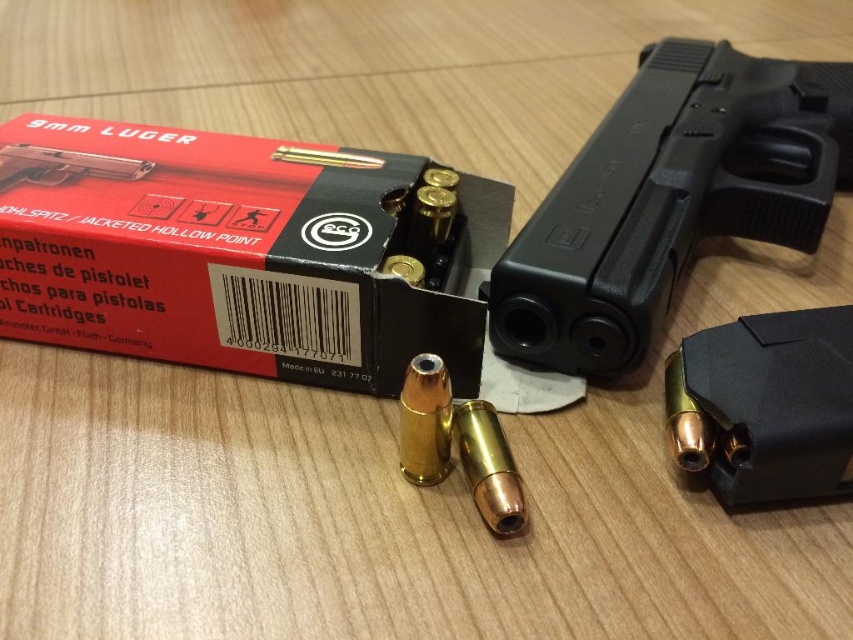
Question: Among these points, which one is farthest from the camera?

Choices:
 (A) (120, 278)
 (B) (618, 348)

Answer: (A)

Question: Can you confirm if red matte box at upper left is positioned above black plastic handgun at upper right?

Choices:
 (A) no
 (B) yes

Answer: (A)

Question: Does red matte box at upper left lie behind black plastic handgun at upper right?

Choices:
 (A) yes
 (B) no

Answer: (B)

Question: Is red matte box at upper left below black plastic handgun at upper right?

Choices:
 (A) no
 (B) yes

Answer: (B)

Question: Among these points, which one is farthest from the camera?

Choices:
 (A) (670, 259)
 (B) (457, 202)

Answer: (B)

Question: Which object appears farthest from the camera in this image?

Choices:
 (A) black plastic handgun at upper right
 (B) red matte box at upper left

Answer: (A)